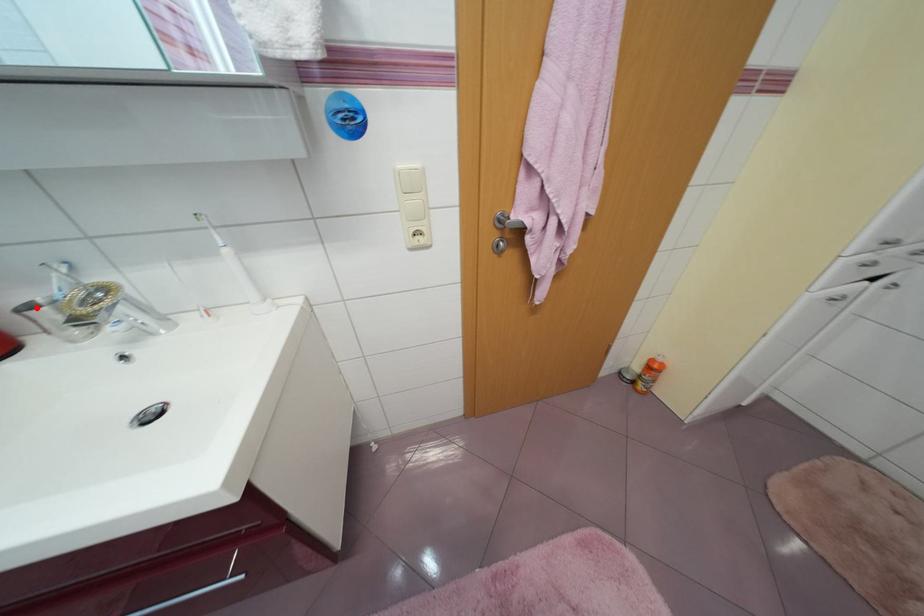
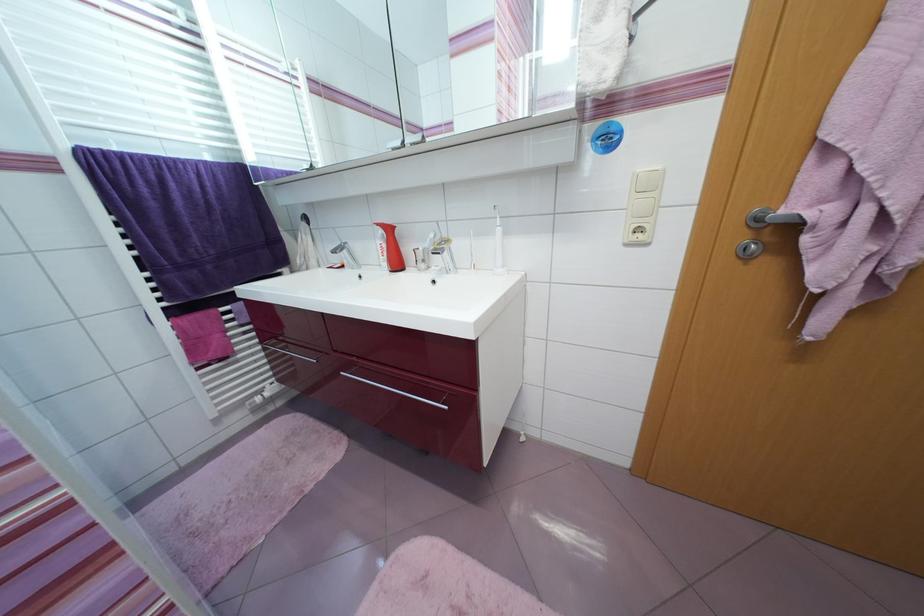
The point at the highlighted location is marked in the first image. Where is the corresponding point in the second image?

(423, 251)